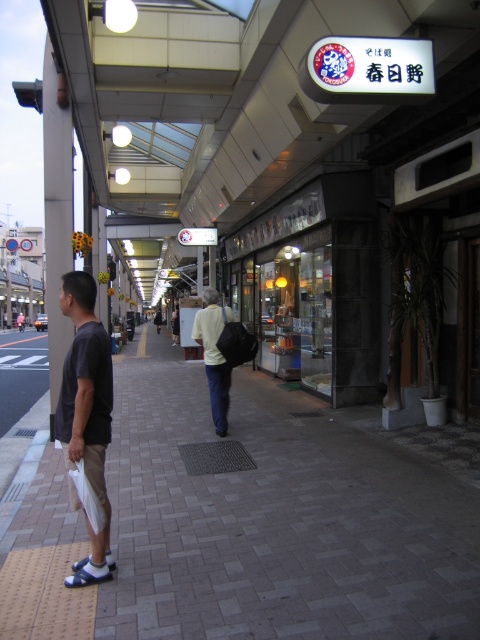
Question: Which object appears closest to the camera in this image?

Choices:
 (A) light beige shirt at center
 (B) dark gray t-shirt at left

Answer: (B)

Question: Considering the relative positions of dark gray t-shirt at left and light beige shirt at center in the image provided, where is dark gray t-shirt at left located with respect to light beige shirt at center?

Choices:
 (A) right
 (B) left

Answer: (B)

Question: Does dark gray t-shirt at left appear under light beige shirt at center?

Choices:
 (A) yes
 (B) no

Answer: (A)

Question: Among these points, which one is nearest to the camera?

Choices:
 (A) (107, 515)
 (B) (211, 342)

Answer: (A)

Question: Does dark gray t-shirt at left appear on the left side of light beige shirt at center?

Choices:
 (A) no
 (B) yes

Answer: (B)